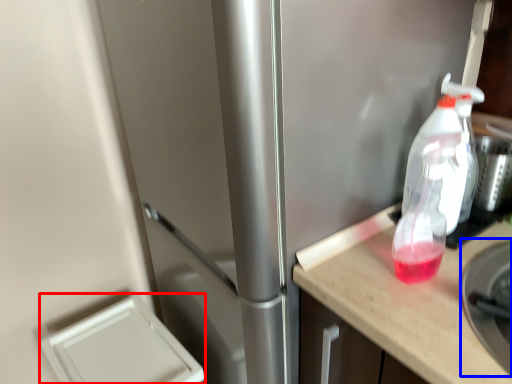
Question: Among these objects, which one is nearest to the camera, appliance (highlighted by a red box) or appliance (highlighted by a blue box)?

Choices:
 (A) appliance
 (B) appliance

Answer: (B)